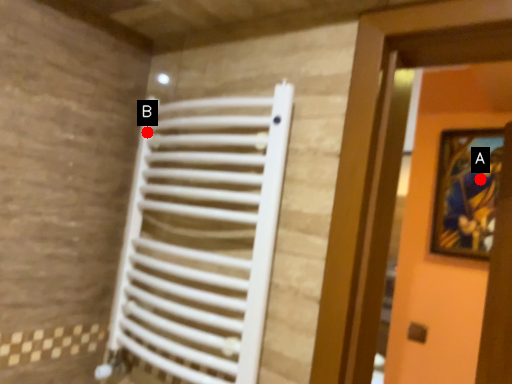
Question: Two points are circled on the image, labeled by A and B beside each circle. Which point is farther from the camera taking this photo?

Choices:
 (A) A is further
 (B) B is further

Answer: (A)